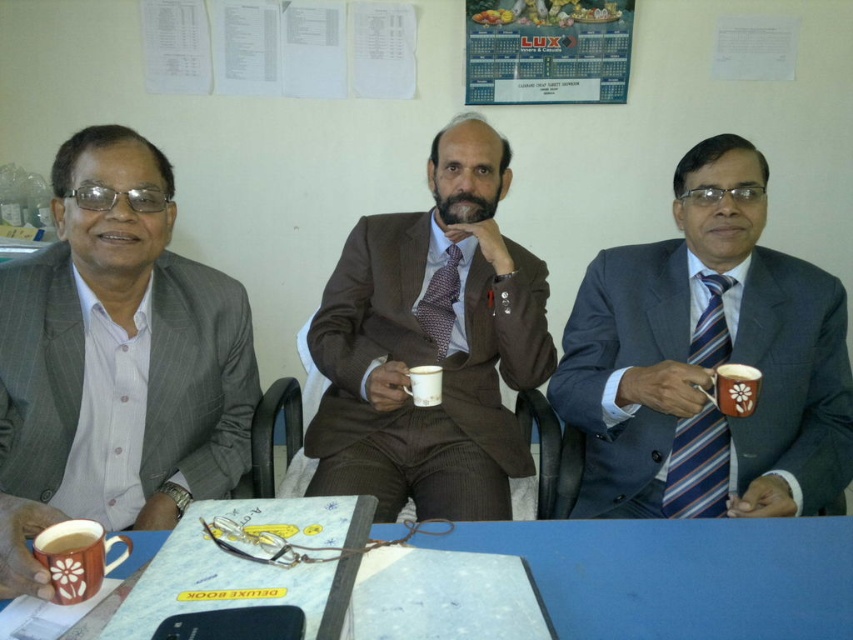
Question: Is blue striped tie at center wider than white ceramic mug at center?

Choices:
 (A) yes
 (B) no

Answer: (A)

Question: Does matte plastic calendar at upper center have a larger size compared to brown ceramic mug at lower left?

Choices:
 (A) no
 (B) yes

Answer: (B)

Question: Which point appears closest to the camera in this image?

Choices:
 (A) (573, 35)
 (B) (697, 417)

Answer: (B)

Question: Estimate the real-world distances between objects in this image. Which object is farther from the matte ceramic mug at lower left?

Choices:
 (A) striped fabric tie at right
 (B) blue striped tie at center
 (C) wooden table at center

Answer: (B)

Question: Can you confirm if matte gray suit at left is bigger than matte plastic calendar at upper center?

Choices:
 (A) yes
 (B) no

Answer: (A)

Question: Based on their relative distances, which object is nearer to the matte ceramic mug at lower left?

Choices:
 (A) matte plastic calendar at upper center
 (B) polka dot silk tie at center
 (C) matte gray suit at left

Answer: (C)